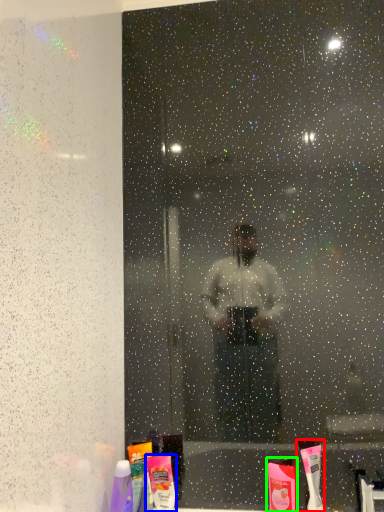
Question: Estimate the real-world distances between objects in this image. Which object is farther from toothbrush (highlighted by a red box), toiletry (highlighted by a blue box) or toiletry (highlighted by a green box)?

Choices:
 (A) toiletry
 (B) toiletry

Answer: (A)